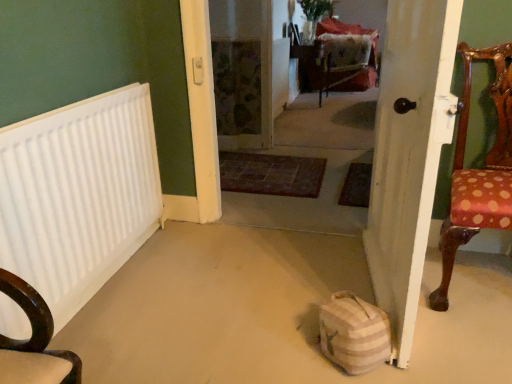
Question: Should I look upward or downward to see carpeted floor at center?

Choices:
 (A) down
 (B) up

Answer: (B)

Question: From the image's perspective, is striped fabric bag at lower center over polka dot fabric chair at right?

Choices:
 (A) yes
 (B) no

Answer: (B)

Question: Does striped fabric bag at lower center lie behind polka dot fabric chair at right?

Choices:
 (A) yes
 (B) no

Answer: (A)

Question: Is striped fabric bag at lower center directly adjacent to polka dot fabric chair at right?

Choices:
 (A) no
 (B) yes

Answer: (A)

Question: Is striped fabric bag at lower center shorter than polka dot fabric chair at right?

Choices:
 (A) yes
 (B) no

Answer: (A)

Question: Is striped fabric bag at lower center to the left of polka dot fabric chair at right from the viewer's perspective?

Choices:
 (A) yes
 (B) no

Answer: (A)

Question: Is striped fabric bag at lower center looking in the opposite direction of polka dot fabric chair at right?

Choices:
 (A) no
 (B) yes

Answer: (B)

Question: Considering the relative sizes of white matte radiator at left and striped fabric bag at lower center in the image provided, is white matte radiator at left taller than striped fabric bag at lower center?

Choices:
 (A) yes
 (B) no

Answer: (A)

Question: Are white matte radiator at left and striped fabric bag at lower center beside each other?

Choices:
 (A) yes
 (B) no

Answer: (B)

Question: Are white matte radiator at left and striped fabric bag at lower center far apart?

Choices:
 (A) yes
 (B) no

Answer: (A)

Question: Is white matte radiator at left positioned beyond the bounds of striped fabric bag at lower center?

Choices:
 (A) no
 (B) yes

Answer: (B)

Question: Does white matte radiator at left have a smaller size compared to striped fabric bag at lower center?

Choices:
 (A) no
 (B) yes

Answer: (A)

Question: Is white matte radiator at left to the right of striped fabric bag at lower center from the viewer's perspective?

Choices:
 (A) no
 (B) yes

Answer: (A)

Question: Is velvet red armchair at center aimed at striped fabric bag at lower center?

Choices:
 (A) no
 (B) yes

Answer: (A)